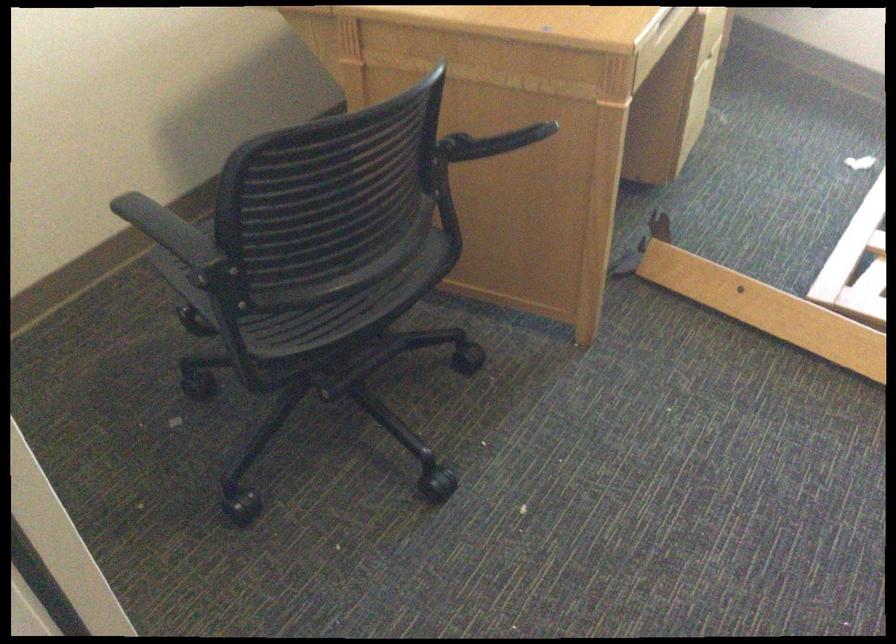
Which object does [767,308] point to?

It corresponds to the wooden plank in the image.